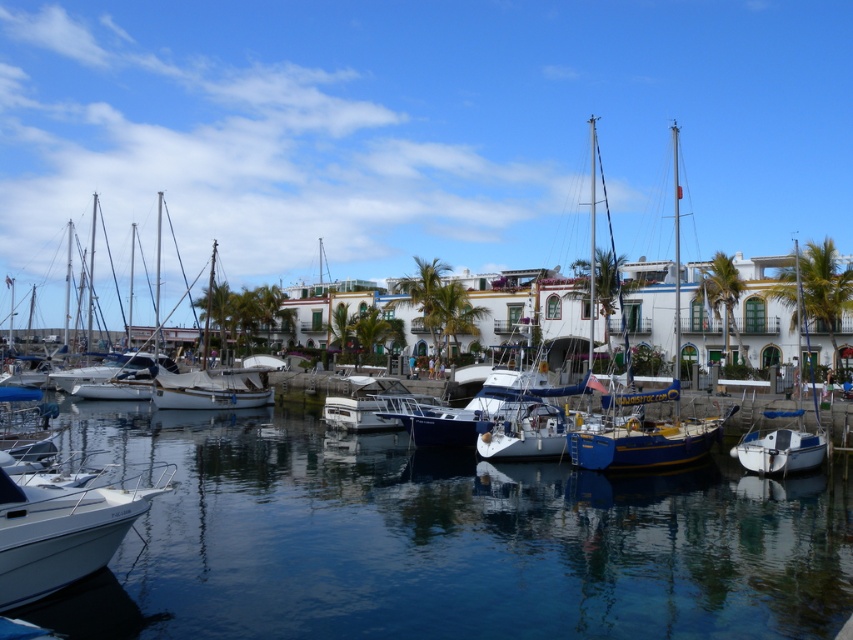
From the picture: You are a marina attendant who needs to park a new boat. You observe the white matte boat at right and the white glossy sailboat at center. Which boat takes up more space in the marina?

The white glossy sailboat at center takes up more space than the white matte boat at right because it occupies more space according to the description.

You are standing at the edge of the marina and see two points marked in the image. The first point is at coordinates point (769,451) and the second is at point (517,433). Which of these two points is closer to you?

Point (769,451) is in front of point (517,433), so it is closer to you.

You are a dock worker who needs to park a new boat that is 10 meters long. You have two available spots next to the white matte boat at right and the white glossy sailboat at center. Based on the scene, which spot can accommodate the new boat?

The white matte boat at right has a larger width than the white glossy sailboat at center, so the spot next to the white matte boat at right can accommodate the new 10 meter long boat.